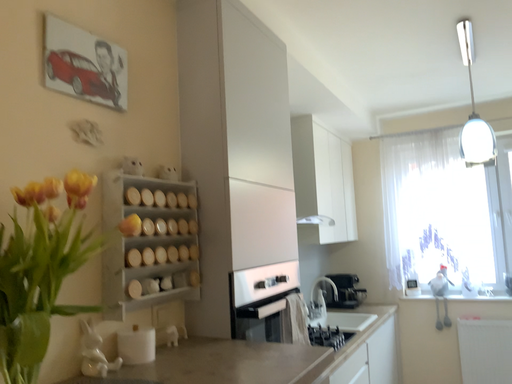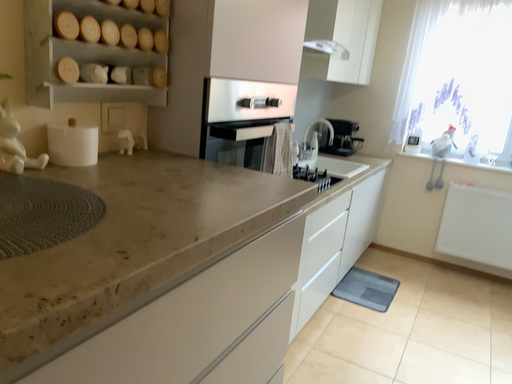
Question: Which way did the camera rotate in the video?

Choices:
 (A) rotated upward
 (B) rotated downward

Answer: (B)